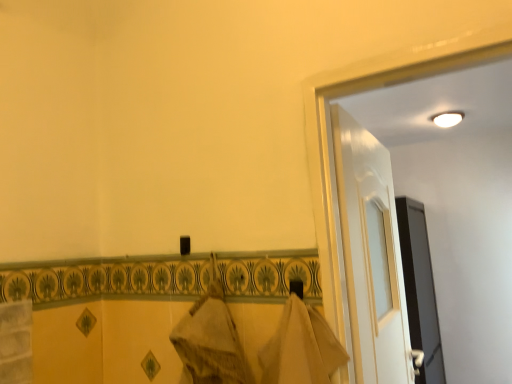
Question: Does white glossy door at upper right have a lesser width compared to white glossy light at upper right?

Choices:
 (A) yes
 (B) no

Answer: (A)

Question: Does white glossy door at upper right turn towards white glossy light at upper right?

Choices:
 (A) yes
 (B) no

Answer: (B)

Question: Is white glossy door at upper right far away from white glossy light at upper right?

Choices:
 (A) yes
 (B) no

Answer: (A)

Question: Is white glossy door at upper right outside white glossy light at upper right?

Choices:
 (A) no
 (B) yes

Answer: (B)

Question: Is white glossy door at upper right to the right of white glossy light at upper right from the viewer's perspective?

Choices:
 (A) yes
 (B) no

Answer: (B)

Question: From a real-world perspective, is white glossy door at upper right above or below black glossy screen door at right?

Choices:
 (A) below
 (B) above

Answer: (B)

Question: From the image's perspective, is white glossy door at upper right located above or below black glossy screen door at right?

Choices:
 (A) above
 (B) below

Answer: (A)

Question: Does point (349, 117) appear closer or farther from the camera than point (407, 256)?

Choices:
 (A) closer
 (B) farther

Answer: (A)

Question: Considering their positions, is white glossy door at upper right located in front of or behind black glossy screen door at right?

Choices:
 (A) front
 (B) behind

Answer: (A)

Question: Considering the positions of point (441, 124) and point (412, 319), is point (441, 124) closer or farther from the camera than point (412, 319)?

Choices:
 (A) farther
 (B) closer

Answer: (A)

Question: From the image's perspective, is white glossy light at upper right positioned above or below black glossy screen door at right?

Choices:
 (A) below
 (B) above

Answer: (B)

Question: In terms of size, does white glossy light at upper right appear bigger or smaller than black glossy screen door at right?

Choices:
 (A) big
 (B) small

Answer: (B)

Question: Considering the positions of white glossy light at upper right and black glossy screen door at right in the image, is white glossy light at upper right wider or thinner than black glossy screen door at right?

Choices:
 (A) wide
 (B) thin

Answer: (B)

Question: In terms of height, does white glossy door at upper right look taller or shorter compared to white glossy light at upper right?

Choices:
 (A) short
 (B) tall

Answer: (B)

Question: From a real-world perspective, relative to white glossy light at upper right, is white glossy door at upper right vertically above or below?

Choices:
 (A) below
 (B) above

Answer: (A)